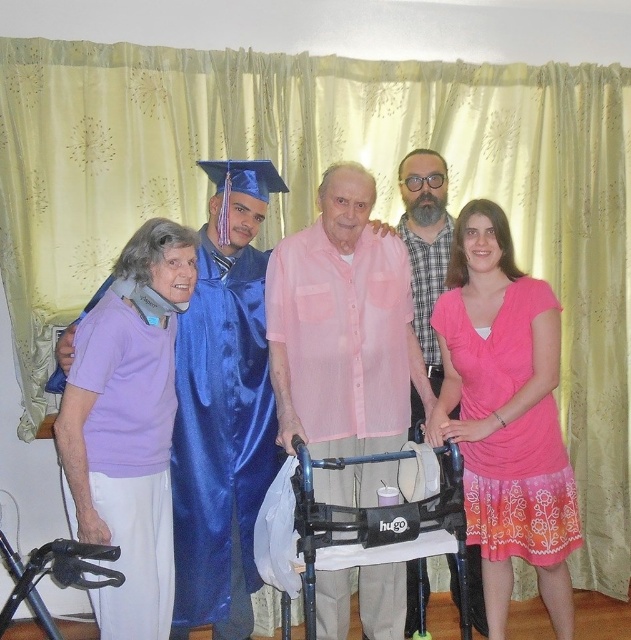
Where is the pink fabric dress at center located in the image?

The pink fabric dress at center is located at the point with coordinates (505, 413).

From the picture: You are a photographer at this graduation celebration. You want to ensure that both the satin blue graduation gown at center and the pink satin walker at center are clearly visible in your photo. Which object should you focus on first to ensure it doesn not get cropped out?

The pink satin walker at center is larger than the satin blue graduation gown at center, so you should focus on the pink satin walker at center first to ensure it fits within the frame.

You are a photographer trying to capture a photo of the two people wearing the pink fabric dress at center and the beige plaid shirt at center. Which one is closer to the camera?

The pink fabric dress at center is positioned under the beige plaid shirt at center, so the beige plaid shirt at center is closer to the camera.